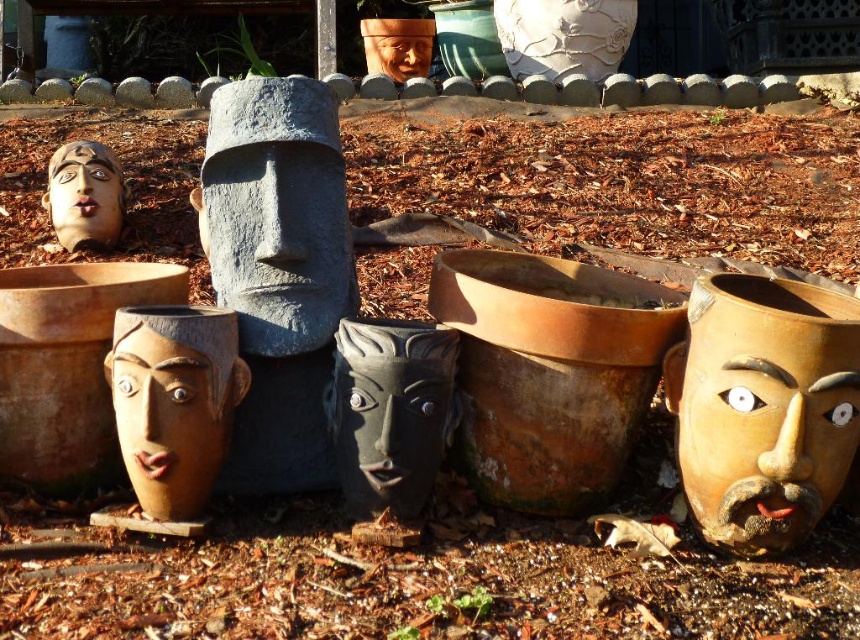
Question: Is black matte mask at center below matte clay mask at upper left?

Choices:
 (A) no
 (B) yes

Answer: (B)

Question: Which point is closer to the camera taking this photo?

Choices:
 (A) (367, 493)
 (B) (759, 392)

Answer: (B)

Question: Observing the image, what is the correct spatial positioning of gray stone statue at center in reference to brown matte mask at lower left?

Choices:
 (A) right
 (B) left

Answer: (A)

Question: Can you confirm if gray stone statue at center is smaller than brown matte mask at lower left?

Choices:
 (A) no
 (B) yes

Answer: (A)

Question: Estimate the real-world distances between objects in this image. Which object is farther from the matte clay mask at upper left?

Choices:
 (A) gray stone statue at center
 (B) black matte mask at center
 (C) brown matte mask at lower left

Answer: (B)

Question: Among these objects, which one is farthest from the camera?

Choices:
 (A) matte clay mask at upper left
 (B) gray stone statue at center

Answer: (A)